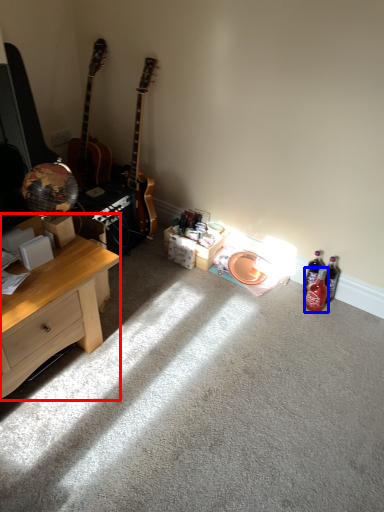
Question: Which object is closer to the camera taking this photo, desk (highlighted by a red box) or bottle (highlighted by a blue box)?

Choices:
 (A) desk
 (B) bottle

Answer: (A)